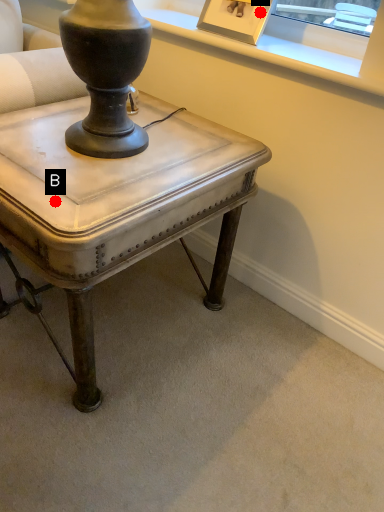
Question: Two points are circled on the image, labeled by A and B beside each circle. Which point is closer to the camera?

Choices:
 (A) A is closer
 (B) B is closer

Answer: (B)